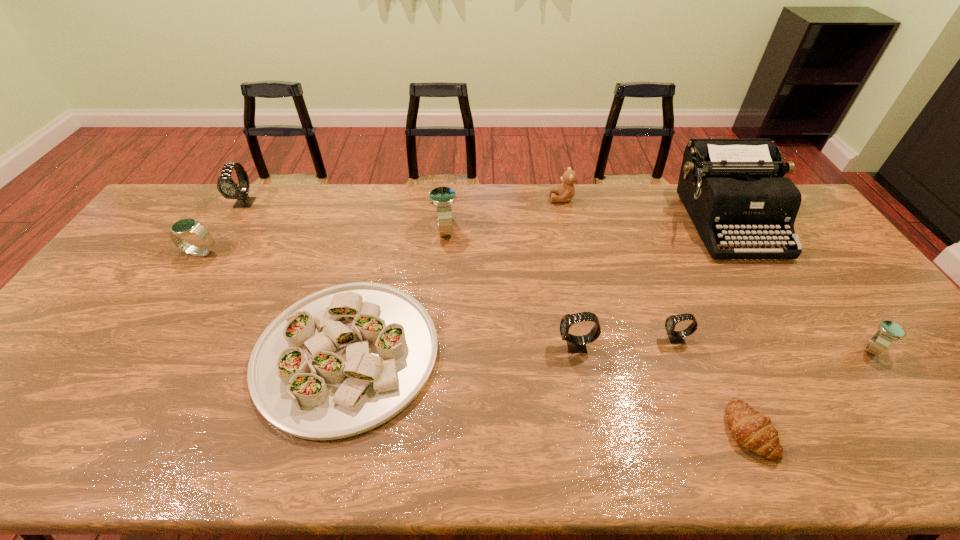
Locate an element on the screen. The height and width of the screenshot is (540, 960). vacant region located 0.160m on the left of the smallest blue watch is located at coordinates (793, 349).

You are a GUI agent. You are given a task and a screenshot of the screen. Output one action in this format:
    pyautogui.click(x=<x>, y=<y>)
    Task: Click on the free location located on the right of the white platter
    This screenshot has height=540, width=960.
    Given the screenshot: What is the action you would take?
    pyautogui.click(x=473, y=354)

You are a GUI agent. You are given a task and a screenshot of the screen. Output one action in this format:
    pyautogui.click(x=<x>, y=<y>)
    Task: Click on the free space located on the back of the eighth object from left to right
    
    Given the screenshot: What is the action you would take?
    pyautogui.click(x=700, y=322)

At what (x,y) coordinates should I click in order to perform the action: click on typewriter situated at the far edge. Please return your answer as a coordinate pair (x, y). Looking at the image, I should click on (725, 185).

You are a GUI agent. You are given a task and a screenshot of the screen. Output one action in this format:
    pyautogui.click(x=<x>, y=<y>)
    Task: Click on the teddy bear present at the far edge
    This screenshot has height=540, width=960.
    Given the screenshot: What is the action you would take?
    pyautogui.click(x=566, y=191)

Find the location of a particular element. platter that is at the near edge is located at coordinates (344, 360).

Where is `crescent roll located in the near edge section of the desktop`? This screenshot has width=960, height=540. crescent roll located in the near edge section of the desktop is located at coordinates (754, 431).

Where is `typewriter present at the right edge`? The height and width of the screenshot is (540, 960). typewriter present at the right edge is located at coordinates (725, 185).

This screenshot has height=540, width=960. I want to click on watch that is at the right edge, so click(889, 331).

You are a GUI agent. You are given a task and a screenshot of the screen. Output one action in this format:
    pyautogui.click(x=<x>, y=<y>)
    Task: Click on the object that is at the far right corner
    This screenshot has width=960, height=540.
    Given the screenshot: What is the action you would take?
    pyautogui.click(x=725, y=185)